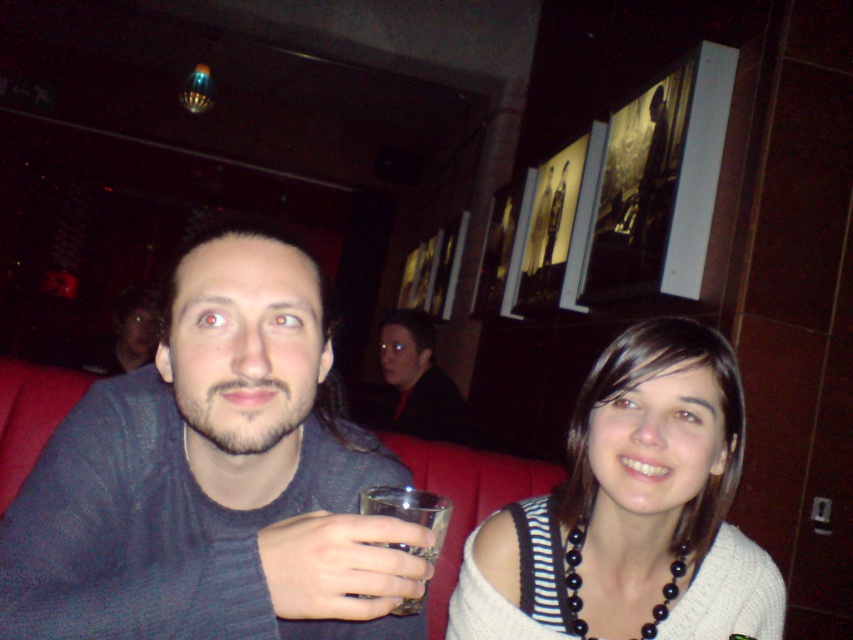
You are a bartender who needs to place a new drink order on the table. The table is between the dark red fabric jacket at center and the transparent glass at lower center. If the table is 5 feet wide, can you fit the order there?

The distance between the dark red fabric jacket at center and the transparent glass at lower center is 7.66 feet. Since the table is 5 feet wide, there is enough space to place the new drink order.

Consider the image. You are standing in the bar and need to place a small item on the table. Is the dark red fabric jacket at center in the way of the table?

The dark red fabric jacket at center is located at point (418, 380), which might be on the table, so placing the item there could be obstructed.